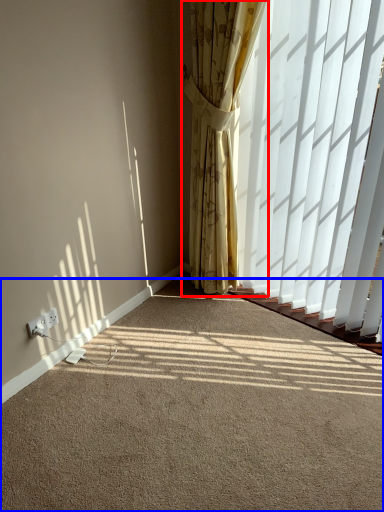
Question: Which of the following is the farthest to the observer, curtain (highlighted by a red box) or plain (highlighted by a blue box)?

Choices:
 (A) curtain
 (B) plain

Answer: (A)